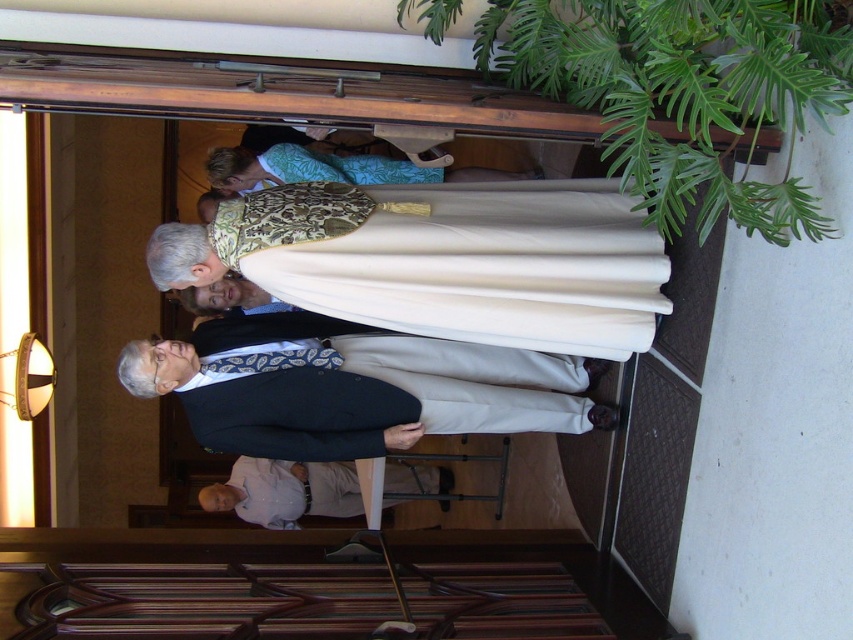
Question: Among these points, which one is nearest to the camera?

Choices:
 (A) (561, 394)
 (B) (316, 493)

Answer: (A)

Question: Does dark blue suit at center appear over light beige fabric shirt at lower center?

Choices:
 (A) yes
 (B) no

Answer: (A)

Question: Does dark blue suit at center appear on the right side of light beige fabric shirt at lower center?

Choices:
 (A) no
 (B) yes

Answer: (B)

Question: Among these objects, which one is farthest from the camera?

Choices:
 (A) dark blue suit at center
 (B) light beige fabric shirt at lower center

Answer: (B)

Question: Can you confirm if dark blue suit at center is smaller than light beige fabric shirt at lower center?

Choices:
 (A) no
 (B) yes

Answer: (A)